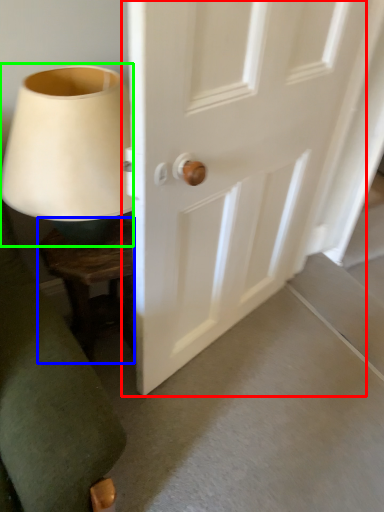
Question: Based on their relative distances, which object is nearer to door (highlighted by a red box)? Choose from furniture (highlighted by a blue box) and table lamp (highlighted by a green box).

Choices:
 (A) furniture
 (B) table lamp

Answer: (B)